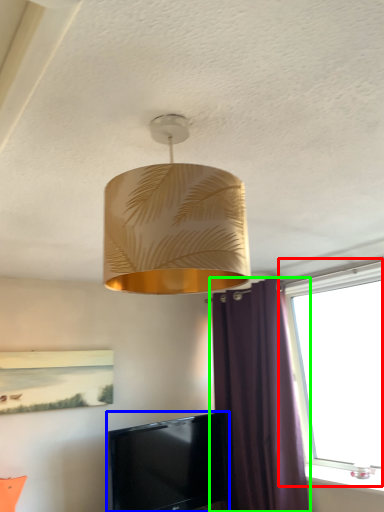
Question: Considering the real-world distances, which object is farthest from window (highlighted by a red box)? television (highlighted by a blue box) or curtain (highlighted by a green box)?

Choices:
 (A) television
 (B) curtain

Answer: (A)